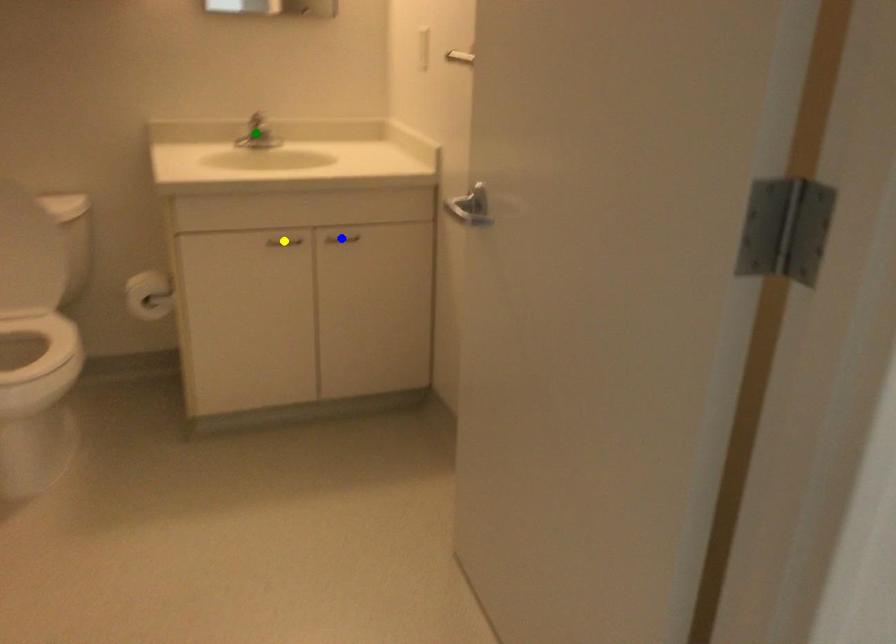
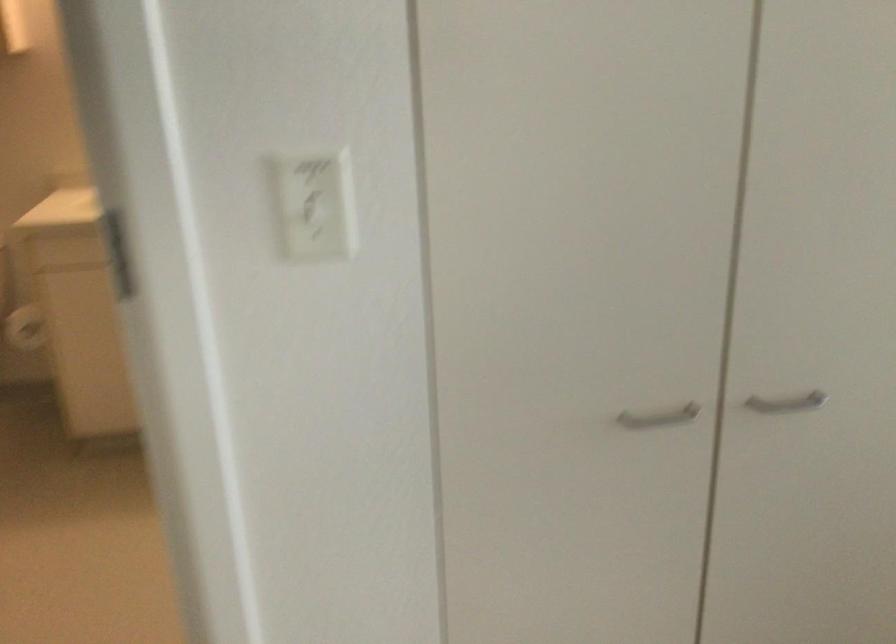
I am providing you with two images of the same scene from different viewpoints. Three points are marked in image1. Which point corresponds to a part or object that is occluded in image2?In image1, three points are marked. Which of them correspond to a part or object that is occluded in image2?Among the three points shown in image1, which one corresponds to a part or object that is no longer visible due to occlusion in image2?

blue point, green point, yellow point